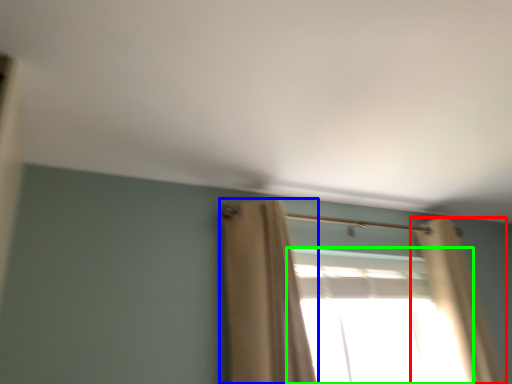
Question: Estimate the real-world distances between objects in this image. Which object is closer to curtain (highlighted by a red box), curtain (highlighted by a blue box) or window (highlighted by a green box)?

Choices:
 (A) curtain
 (B) window

Answer: (B)